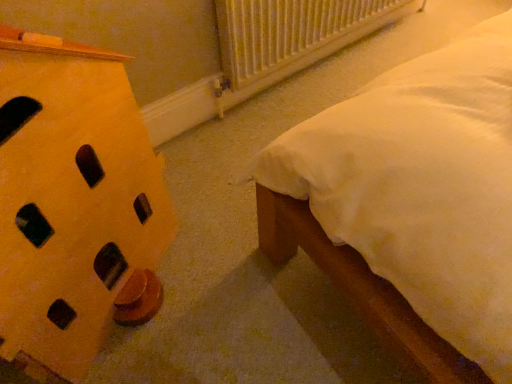
Image resolution: width=512 pixels, height=384 pixels. Find the location of `yellow matte wooden block at left`. yellow matte wooden block at left is located at coordinates (73, 204).

In order to face white plastic radiator at upper center, should I rotate leftwards or rightwards?

Rotate your view right by about 10.217°.

Where is `yellow matte wooden block at left`? This screenshot has height=384, width=512. yellow matte wooden block at left is located at coordinates (73, 204).

Is yellow matte wooden block at left facing towards white plastic radiator at upper center?

No, yellow matte wooden block at left is not facing towards white plastic radiator at upper center.

Is point (96, 121) behind point (285, 45)?

No, it is not.

Can you confirm if yellow matte wooden block at left is bigger than white plastic radiator at upper center?

Correct, yellow matte wooden block at left is larger in size than white plastic radiator at upper center.

Locate an element on the screen. The height and width of the screenshot is (384, 512). furniture below the white plastic radiator at upper center (from the image's perspective) is located at coordinates (73, 204).

Between yellow matte wooden block at left and yellow matte nightstand at left, which one appears on the left side from the viewer's perspective?

yellow matte wooden block at left.

Is yellow matte wooden block at left wider than yellow matte nightstand at left?

In fact, yellow matte wooden block at left might be narrower than yellow matte nightstand at left.

Which object is closer to the camera taking this photo, yellow matte wooden block at left or yellow matte nightstand at left?

yellow matte wooden block at left is in front.

Is yellow matte nightstand at left positioned beyond the bounds of white plastic radiator at upper center?

yellow matte nightstand at left lies outside white plastic radiator at upper center's area.

Considering the sizes of objects yellow matte nightstand at left and white plastic radiator at upper center in the image provided, who is bigger, yellow matte nightstand at left or white plastic radiator at upper center?

yellow matte nightstand at left is bigger.

In terms of height, does yellow matte nightstand at left look taller or shorter compared to white plastic radiator at upper center?

Clearly, yellow matte nightstand at left is shorter compared to white plastic radiator at upper center.

How distant is white plastic radiator at upper center from yellow matte wooden block at left?

white plastic radiator at upper center is 30.39 inches from yellow matte wooden block at left.

Is white plastic radiator at upper center directly adjacent to yellow matte wooden block at left?

No, white plastic radiator at upper center is not making contact with yellow matte wooden block at left.

Considering the relative sizes of white plastic radiator at upper center and yellow matte wooden block at left in the image provided, is white plastic radiator at upper center shorter than yellow matte wooden block at left?

Indeed, white plastic radiator at upper center has a lesser height compared to yellow matte wooden block at left.

Which of these two, white plastic radiator at upper center or yellow matte wooden block at left, is smaller?

Smaller between the two is white plastic radiator at upper center.

Is white plastic radiator at upper center thinner than yellow matte nightstand at left?

Yes.

Based on the photo, is white plastic radiator at upper center taller or shorter than yellow matte nightstand at left?

white plastic radiator at upper center is taller than yellow matte nightstand at left.

The width and height of the screenshot is (512, 384). What are the coordinates of `radiator above the yellow matte nightstand at left (from the image's perspective)` in the screenshot? It's located at (292, 34).

Are white plastic radiator at upper center and yellow matte nightstand at left far apart?

No, white plastic radiator at upper center is in close proximity to yellow matte nightstand at left.

Is yellow matte nightstand at left oriented towards yellow matte wooden block at left?

No, yellow matte nightstand at left does not turn towards yellow matte wooden block at left.

From a real-world perspective, is yellow matte nightstand at left positioned over yellow matte wooden block at left based on gravity?

No, from a real-world perspective, yellow matte nightstand at left is not above yellow matte wooden block at left.

Between yellow matte nightstand at left and yellow matte wooden block at left, which one is positioned behind?

Positioned behind is yellow matte nightstand at left.

How far apart are yellow matte nightstand at left and yellow matte wooden block at left?

A distance of 47.65 centimeters exists between yellow matte nightstand at left and yellow matte wooden block at left.

Where is `radiator located underneath the yellow matte wooden block at left (from a real-world perspective)`? Image resolution: width=512 pixels, height=384 pixels. radiator located underneath the yellow matte wooden block at left (from a real-world perspective) is located at coordinates (292, 34).

Where is `furniture above the yellow matte nightstand at left (from a real-world perspective)`? Image resolution: width=512 pixels, height=384 pixels. furniture above the yellow matte nightstand at left (from a real-world perspective) is located at coordinates (73, 204).

Estimate the real-world distances between objects in this image. Which object is closer to white plastic radiator at upper center, yellow matte nightstand at left or yellow matte wooden block at left?

Among the two, yellow matte nightstand at left is located nearer to white plastic radiator at upper center.

Based on the photo, estimate the real-world distances between objects in this image. Which object is closer to yellow matte wooden block at left, yellow matte nightstand at left or white plastic radiator at upper center?

yellow matte nightstand at left.

From the picture: When comparing their distances from white plastic radiator at upper center, does yellow matte wooden block at left or yellow matte nightstand at left seem closer?

Based on the image, yellow matte nightstand at left appears to be nearer to white plastic radiator at upper center.

Looking at this image, looking at the image, which one is located closer to yellow matte wooden block at left, white plastic radiator at upper center or yellow matte nightstand at left?

yellow matte nightstand at left is positioned closer to the anchor yellow matte wooden block at left.

Based on their spatial positions, is yellow matte wooden block at left or white plastic radiator at upper center further from yellow matte nightstand at left?

Based on the image, white plastic radiator at upper center appears to be further to yellow matte nightstand at left.

Looking at the image, which one is located closer to yellow matte nightstand at left, white plastic radiator at upper center or yellow matte wooden block at left?

Based on the image, yellow matte wooden block at left appears to be nearer to yellow matte nightstand at left.

This screenshot has width=512, height=384. I want to click on radiator between yellow matte wooden block at left and yellow matte nightstand at left from left to right, so click(x=292, y=34).